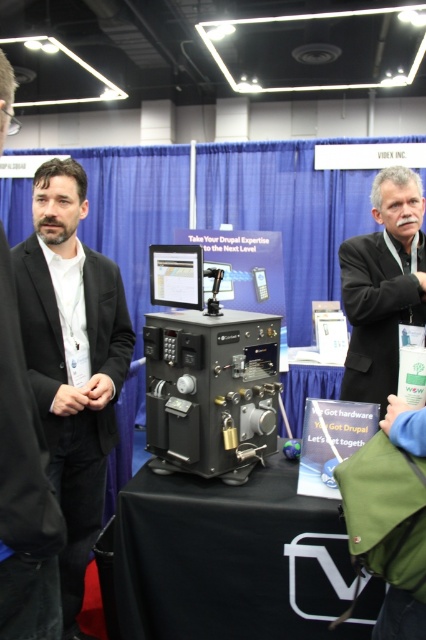
Question: Is black fabric table at center positioned at the back of black matte suit at left?

Choices:
 (A) no
 (B) yes

Answer: (A)

Question: In this image, where is black fabric table at center located relative to black matte suit at left?

Choices:
 (A) below
 (B) above

Answer: (A)

Question: Among these objects, which one is nearest to the camera?

Choices:
 (A) black suit at center
 (B) black fabric table at center

Answer: (B)

Question: Which point appears farthest from the camera in this image?

Choices:
 (A) (294, 470)
 (B) (63, 616)
 (C) (219, 412)

Answer: (B)

Question: Which of the following is the closest to the observer?

Choices:
 (A) (261, 634)
 (B) (371, 250)

Answer: (A)

Question: Does matte black suit at left appear under black suit at center?

Choices:
 (A) no
 (B) yes

Answer: (B)